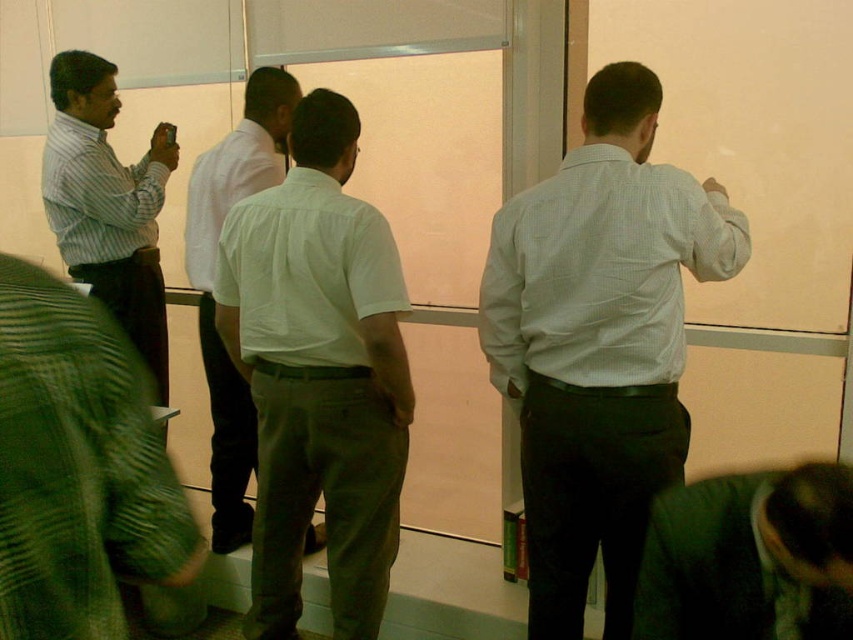
Question: Considering the relative positions of white cotton shirt at center and striped cotton shirt at left in the image provided, where is white cotton shirt at center located with respect to striped cotton shirt at left?

Choices:
 (A) left
 (B) right

Answer: (B)

Question: In this image, where is dark green suit at lower right located relative to striped cotton shirt at left?

Choices:
 (A) above
 (B) below

Answer: (B)

Question: Which of these objects is positioned closest to the white cotton shirt at center?

Choices:
 (A) striped cotton shirt at left
 (B) green textured shirt at lower left
 (C) white shirt at left
 (D) white checkered shirt at right

Answer: (D)

Question: Estimate the real-world distances between objects in this image. Which object is farther from the green textured shirt at lower left?

Choices:
 (A) white shirt at left
 (B) white cotton shirt at center
 (C) striped cotton shirt at left
 (D) white checkered shirt at right

Answer: (C)

Question: Where is white cotton shirt at center located in relation to white shirt at left in the image?

Choices:
 (A) left
 (B) right

Answer: (B)

Question: Which point is closer to the camera taking this photo?

Choices:
 (A) (129, 573)
 (B) (653, 259)
 (C) (337, 100)

Answer: (A)